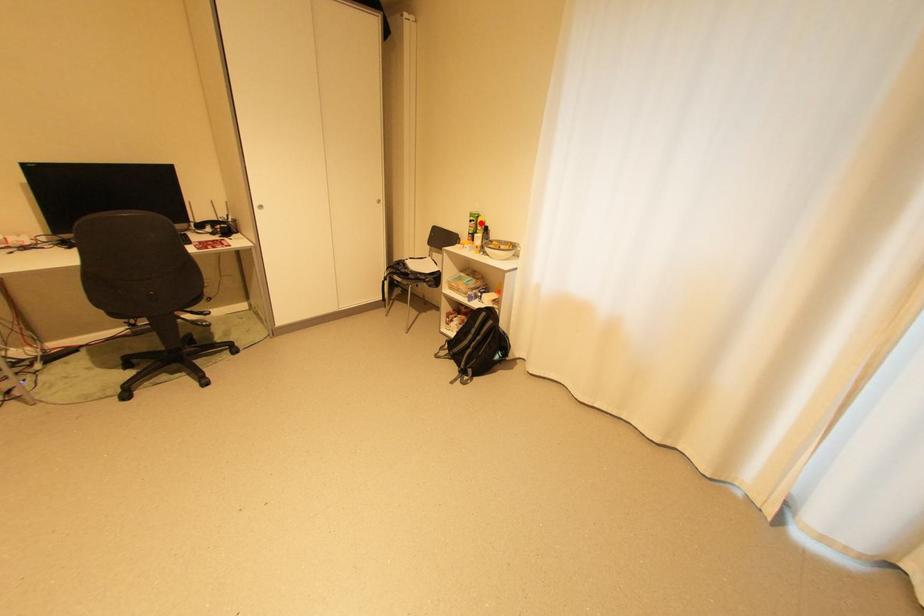
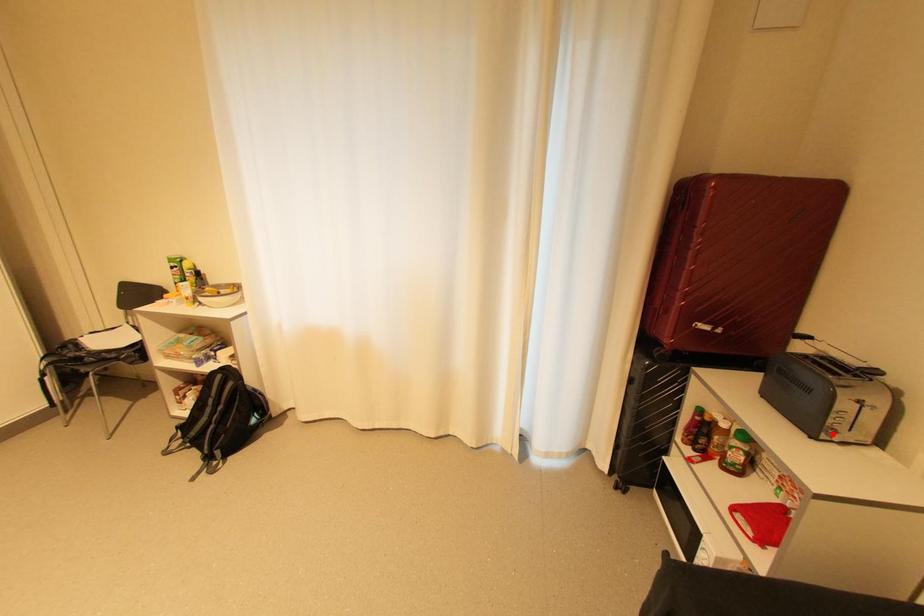
I am providing you with two images of the same scene from different viewpoints. A red point is marked on the first image and another point is marked on the second image. Is the red point in image1 aligned with the point shown in image2?

No